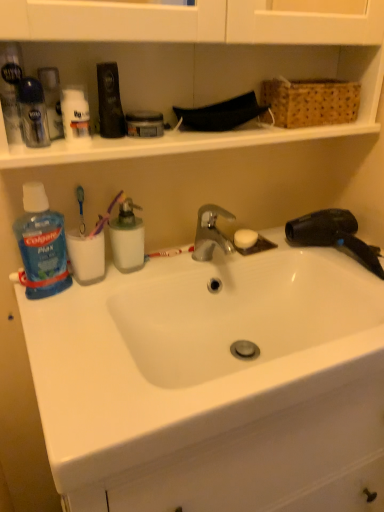
Identify the location of translucent plastic container at center, positioned as the second cleaning product in left-to-right order. This screenshot has height=512, width=384. (127, 237).

What do you see at coordinates (171, 251) in the screenshot? The width and height of the screenshot is (384, 512). I see `white plastic toothbrush at center` at bounding box center [171, 251].

Measure the distance between blue plastic mouthwash at left, the second cleaning product viewed from the right, and camera.

The distance of blue plastic mouthwash at left, the second cleaning product viewed from the right, from camera is 30.70 inches.

What do you see at coordinates (244, 311) in the screenshot? This screenshot has width=384, height=512. I see `white ceramic sink at center` at bounding box center [244, 311].

In order to face white ceramic sink at center, should I rotate leftwards or rightwards?

To align with it, rotate right about 7.992°.

Describe the element at coordinates (75, 113) in the screenshot. I see `white matte deodorant at upper left, arranged as the third toiletry when viewed from the left` at that location.

Measure the distance between white matte deodorant at upper left, arranged as the third toiletry when viewed from the left, and camera.

white matte deodorant at upper left, arranged as the third toiletry when viewed from the left, is 28.46 inches from camera.

Describe the element at coordinates (33, 113) in the screenshot. I see `translucent plastic deodorant at upper left, which appears as the 1th toiletry when viewed from the left` at that location.

Find the location of a particular element. The image size is (384, 512). translucent plastic container at center, positioned as the second cleaning product in left-to-right order is located at coordinates (127, 237).

Starting from the translucent plastic deodorant at upper left, which appears as the 1th toiletry when viewed from the left, which cleaning product is the 1st one behind? Please provide its 2D coordinates.

[(41, 246)]

From the image's perspective, is blue plastic mouthwash at left, which is the 1th cleaning product in left-to-right order, on top of translucent plastic deodorant at upper left, which appears as the third toiletry when viewed from the right?

No, from the image's perspective, blue plastic mouthwash at left, which is the 1th cleaning product in left-to-right order, is not on top of translucent plastic deodorant at upper left, which appears as the third toiletry when viewed from the right.

Which is more to the right, blue plastic mouthwash at left, the second cleaning product viewed from the right, or translucent plastic deodorant at upper left, which appears as the third toiletry when viewed from the right?

From the viewer's perspective, translucent plastic deodorant at upper left, which appears as the third toiletry when viewed from the right, appears more on the right side.

Based on the photo, is translucent plastic deodorant at upper left, which appears as the third toiletry when viewed from the right, at the back of blue plastic mouthwash at left, which is the 1th cleaning product in left-to-right order?

That's not correct — blue plastic mouthwash at left, which is the 1th cleaning product in left-to-right order, is not looking away from translucent plastic deodorant at upper left, which appears as the third toiletry when viewed from the right.

From a real-world perspective, is white plastic toothbrush at center beneath white matte deodorant at upper left, arranged as the third toiletry when viewed from the left?

Yes, from a real-world perspective, white plastic toothbrush at center is below white matte deodorant at upper left, arranged as the third toiletry when viewed from the left.

From the image's perspective, relative to white matte deodorant at upper left, arranged as the third toiletry when viewed from the left, is white plastic toothbrush at center above or below?

Based on their image positions, white plastic toothbrush at center is located beneath white matte deodorant at upper left, arranged as the third toiletry when viewed from the left.

Is white plastic toothbrush at center far away from white matte deodorant at upper left, arranged as the third toiletry when viewed from the left?

No, there isn't a large distance between white plastic toothbrush at center and white matte deodorant at upper left, arranged as the third toiletry when viewed from the left.

Is point (308, 291) in front of point (344, 118)?

No, it is behind (344, 118).

From a real-world perspective, who is located lower, white ceramic sink at center or woven brown basket at upper right?

From a 3D spatial view, white ceramic sink at center is below.

Is white ceramic sink at center at the right side of woven brown basket at upper right?

In fact, white ceramic sink at center is to the left of woven brown basket at upper right.

Is white ceramic sink at center facing towards woven brown basket at upper right?

No, white ceramic sink at center does not turn towards woven brown basket at upper right.

Locate an element on the screen. The image size is (384, 512). basket behind the white matte deodorant at upper left, the 1th toiletry viewed from the right is located at coordinates (311, 102).

Does woven brown basket at upper right contain white matte deodorant at upper left, the 1th toiletry viewed from the right?

No, woven brown basket at upper right does not contain white matte deodorant at upper left, the 1th toiletry viewed from the right.

Is woven brown basket at upper right thinner than white matte deodorant at upper left, the 1th toiletry viewed from the right?

No, woven brown basket at upper right is not thinner than white matte deodorant at upper left, the 1th toiletry viewed from the right.

Is woven brown basket at upper right looking in the opposite direction of white matte deodorant at upper left, the 1th toiletry viewed from the right?

That's not correct — woven brown basket at upper right is not looking away from white matte deodorant at upper left, the 1th toiletry viewed from the right.

What's the angular difference between white plastic toothbrush at center and woven brown basket at upper right's facing directions?

The angular difference between white plastic toothbrush at center and woven brown basket at upper right is 3.67 degrees.

Would you say white plastic toothbrush at center contains woven brown basket at upper right?

Actually, woven brown basket at upper right is outside white plastic toothbrush at center.

How much distance is there between white plastic toothbrush at center and woven brown basket at upper right?

The distance of white plastic toothbrush at center from woven brown basket at upper right is 41.19 centimeters.

Consider the image. Does white plastic toothbrush at center have a lesser width compared to woven brown basket at upper right?

Yes.

Does blue plastic mouthwash at left, which is the 1th cleaning product in left-to-right order, turn towards woven brown basket at upper right?

No, blue plastic mouthwash at left, which is the 1th cleaning product in left-to-right order, does not turn towards woven brown basket at upper right.

Is blue plastic mouthwash at left, the second cleaning product viewed from the right, touching woven brown basket at upper right?

No, blue plastic mouthwash at left, the second cleaning product viewed from the right, is not touching woven brown basket at upper right.

From the image's perspective, which one is positioned higher, blue plastic mouthwash at left, which is the 1th cleaning product in left-to-right order, or woven brown basket at upper right?

woven brown basket at upper right is shown above in the image.

Do you think blue plastic mouthwash at left, which is the 1th cleaning product in left-to-right order, is within woven brown basket at upper right, or outside of it?

blue plastic mouthwash at left, which is the 1th cleaning product in left-to-right order, lies outside woven brown basket at upper right.

Is woven brown basket at upper right aimed at white plastic toothbrush at center?

No.

Does woven brown basket at upper right have a lesser width compared to white plastic toothbrush at center?

In fact, woven brown basket at upper right might be wider than white plastic toothbrush at center.

This screenshot has width=384, height=512. In order to click on toothbrush below the woven brown basket at upper right (from a real-world perspective) in this screenshot , I will do `click(171, 251)`.

From the image's perspective, starting from the blue plastic mouthwash at left, which is the 1th cleaning product in left-to-right order, which toiletry is the 1st one above? Please provide its 2D coordinates.

[(33, 113)]

The width and height of the screenshot is (384, 512). I want to click on toothbrush lying on the right of white matte deodorant at upper left, the 1th toiletry viewed from the right, so (x=171, y=251).

Looking at the image, which one is located closer to white ceramic sink at center, white plastic toothbrush at center or translucent plastic deodorant at upper left, which appears as the third toiletry when viewed from the right?

white plastic toothbrush at center is closer to white ceramic sink at center.

Based on the photo, from the image, which object appears to be farther from translucent plastic deodorant at upper left, which appears as the third toiletry when viewed from the right, white plastic toothbrush at center or white matte deodorant at upper left, arranged as the third toiletry when viewed from the left?

white plastic toothbrush at center.

Based on their spatial positions, is blue plastic mouthwash at left, the second cleaning product viewed from the right, or translucent plastic container at center, positioned as the second cleaning product in left-to-right order, further from clear plastic shaving cream canister at upper left, acting as the 2th toiletry starting from the left?

Based on the image, translucent plastic container at center, positioned as the second cleaning product in left-to-right order, appears to be further to clear plastic shaving cream canister at upper left, acting as the 2th toiletry starting from the left.

From the image, which object appears to be nearer to translucent plastic deodorant at upper left, which appears as the 1th toiletry when viewed from the left, white plastic toothbrush at center or translucent plastic container at center, positioned as the second cleaning product in left-to-right order?

translucent plastic container at center, positioned as the second cleaning product in left-to-right order, is positioned closer to the anchor translucent plastic deodorant at upper left, which appears as the 1th toiletry when viewed from the left.

When comparing their distances from translucent plastic container at center, acting as the 1th cleaning product starting from the right, does white matte deodorant at upper left, arranged as the third toiletry when viewed from the left, or translucent plastic deodorant at upper left, which appears as the 1th toiletry when viewed from the left, seem closer?

Based on the image, white matte deodorant at upper left, arranged as the third toiletry when viewed from the left, appears to be nearer to translucent plastic container at center, acting as the 1th cleaning product starting from the right.

Which object lies further to the anchor point translucent plastic container at center, positioned as the second cleaning product in left-to-right order, woven brown basket at upper right or white plastic toothbrush at center?

woven brown basket at upper right.

When comparing their distances from clear plastic shaving cream canister at upper left, the second toiletry in the right-to-left sequence, does translucent plastic deodorant at upper left, which appears as the third toiletry when viewed from the right, or white matte deodorant at upper left, arranged as the third toiletry when viewed from the left, seem further?

translucent plastic deodorant at upper left, which appears as the third toiletry when viewed from the right, lies further to clear plastic shaving cream canister at upper left, the second toiletry in the right-to-left sequence, than the other object.

From the image, which object appears to be farther from blue plastic mouthwash at left, which is the 1th cleaning product in left-to-right order, white plastic toothbrush at center or woven brown basket at upper right?

woven brown basket at upper right.

Locate an element on the screen. Image resolution: width=384 pixels, height=512 pixels. sink situated between translucent plastic deodorant at upper left, which appears as the third toiletry when viewed from the right, and woven brown basket at upper right from left to right is located at coordinates (244, 311).

Locate an element on the screen. cleaning product between clear plastic shaving cream canister at upper left, the second toiletry in the right-to-left sequence, and blue plastic mouthwash at left, the second cleaning product viewed from the right, from top to bottom is located at coordinates (127, 237).

At what (x,y) coordinates should I click in order to perform the action: click on toiletry between clear plastic shaving cream canister at upper left, the second toiletry in the right-to-left sequence, and woven brown basket at upper right from left to right. Please return your answer as a coordinate pair (x, y). The width and height of the screenshot is (384, 512). Looking at the image, I should click on (75, 113).

At what (x,y) coordinates should I click in order to perform the action: click on cleaning product between translucent plastic deodorant at upper left, which appears as the third toiletry when viewed from the right, and blue plastic mouthwash at left, which is the 1th cleaning product in left-to-right order, in the vertical direction. Please return your answer as a coordinate pair (x, y). This screenshot has height=512, width=384. Looking at the image, I should click on (127, 237).